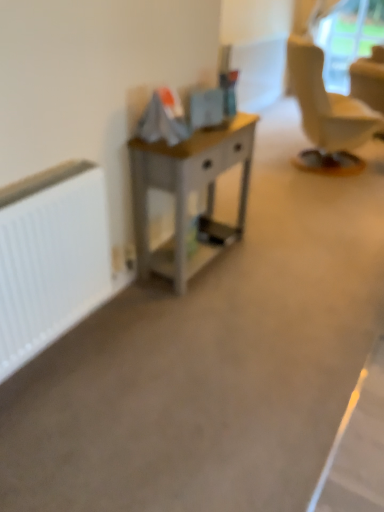
Question: Choose the correct answer: Is transparent plastic window screen at upper right inside wooden desk at center or outside it?

Choices:
 (A) outside
 (B) inside

Answer: (A)

Question: Based on their positions, is transparent plastic window screen at upper right located to the left or right of wooden desk at center?

Choices:
 (A) left
 (B) right

Answer: (B)

Question: Considering the real-world distances, which object is farthest from the transparent plastic window screen at upper right?

Choices:
 (A) white matte radiator at left
 (B) wooden desk at center

Answer: (A)

Question: Which of these objects is positioned closest to the transparent plastic window screen at upper right?

Choices:
 (A) white matte radiator at left
 (B) wooden desk at center

Answer: (B)